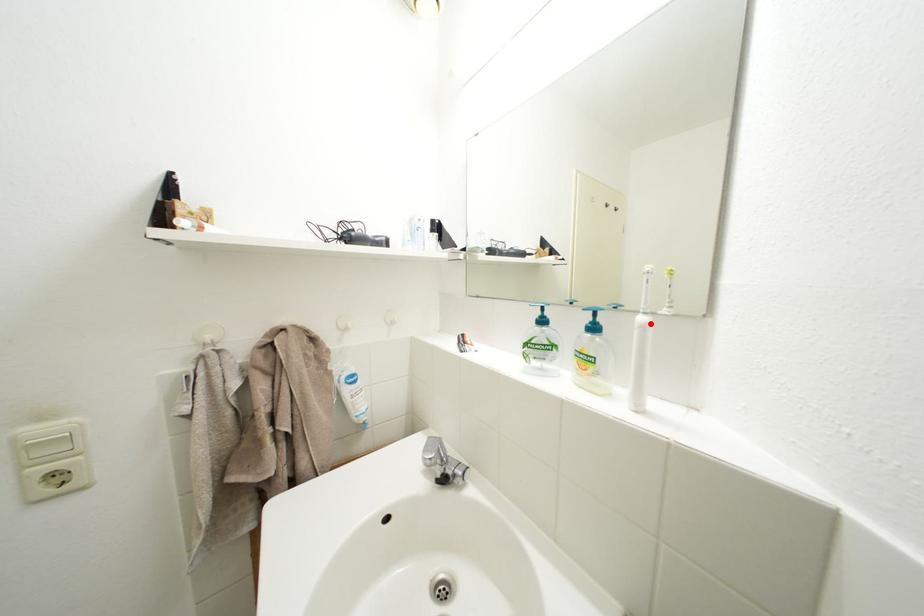
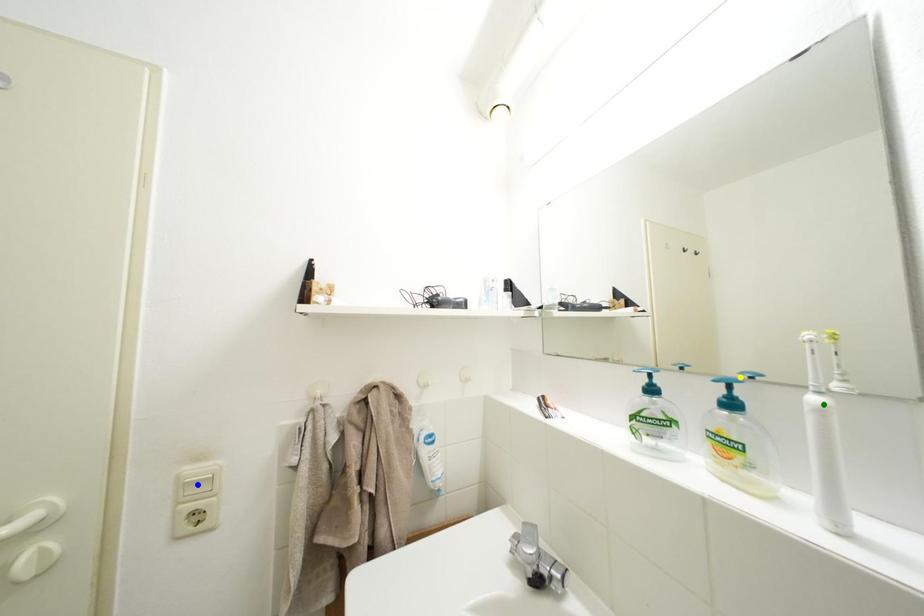
Question: I am providing you with two images of the same scene from different viewpoints. A red point is marked on the first image. You are given multiple points on the second image. Which point in image 2 represents the same 3d spot as the red point in image 1?

Choices:
 (A) green point
 (B) yellow point
 (C) blue point

Answer: (A)